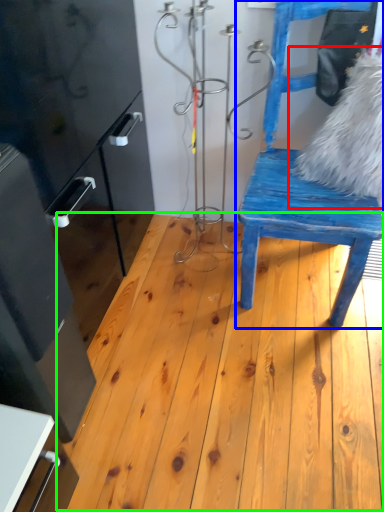
Question: Based on their relative distances, which object is nearer to animal (highlighted by a red box)? Choose from chair (highlighted by a blue box) and hardwood (highlighted by a green box).

Choices:
 (A) chair
 (B) hardwood

Answer: (A)